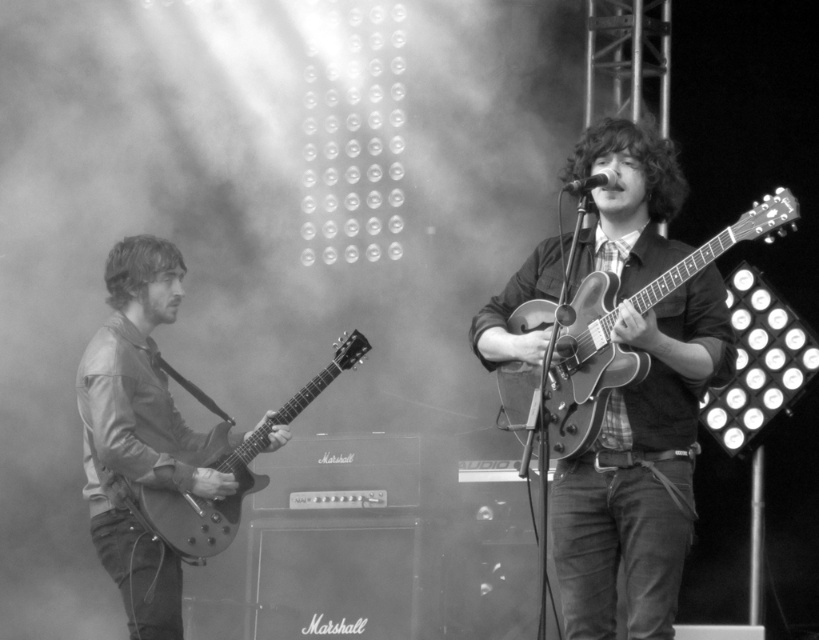
Between matte guitar at center and glossy wood guitar at left, which one has less height?

glossy wood guitar at left is shorter.

Can you confirm if matte guitar at center is thinner than glossy wood guitar at left?

Yes, matte guitar at center is thinner than glossy wood guitar at left.

Does point (582, 465) come in front of point (181, 538)?

Yes, it is in front of point (181, 538).

Identify the location of matte guitar at center. (637, 401).

Is matte black guitar at left above matte wood guitar at center?

Incorrect, matte black guitar at left is not positioned above matte wood guitar at center.

Does point (112, 509) lie behind point (545, 316)?

Yes, it is behind point (545, 316).

Is point (156, 618) farther from camera compared to point (777, 196)?

Yes, it is.

The width and height of the screenshot is (819, 640). What are the coordinates of `matte black guitar at left` in the screenshot? It's located at (138, 433).

Is point (713, 237) less distant than point (222, 465)?

Yes.

Which is below, matte wood guitar at center or glossy wood guitar at left?

glossy wood guitar at left

The width and height of the screenshot is (819, 640). I want to click on matte wood guitar at center, so click(x=581, y=360).

Locate an element on the screen. matte wood guitar at center is located at coordinates (581, 360).